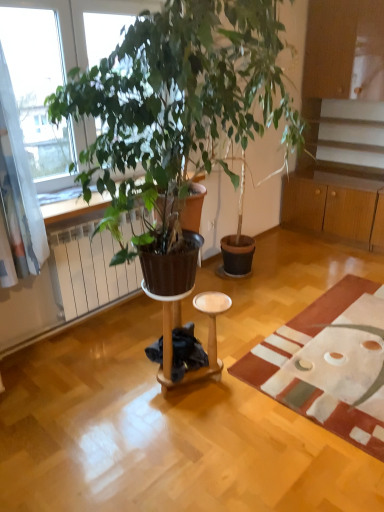
Measure the distance between wooden cabinet at right and camera.

The distance of wooden cabinet at right from camera is 3.32 meters.

The height and width of the screenshot is (512, 384). I want to click on brown matte radiator at left, so click(x=88, y=270).

The image size is (384, 512). Describe the element at coordinates (329, 362) in the screenshot. I see `textured beige rug at lower right` at that location.

What are the coordinates of `textured beige rug at lower right` in the screenshot? It's located at (329, 362).

The image size is (384, 512). In order to click on wooden cabinet at right in this screenshot , I will do [345, 85].

From a real-world perspective, between textured beige rug at lower right and wooden cabinet at right, who is vertically lower?

textured beige rug at lower right, from a real-world perspective.

Does textured beige rug at lower right turn towards wooden cabinet at right?

No, textured beige rug at lower right is not oriented towards wooden cabinet at right.

Is textured beige rug at lower right not near wooden cabinet at right?

Yes.

Which object is thinner, textured beige rug at lower right or wooden cabinet at right?

wooden cabinet at right.

Is textured beige rug at lower right turned away from wooden side table at center?

No, textured beige rug at lower right's orientation is not away from wooden side table at center.

Would you say textured beige rug at lower right is a long distance from wooden side table at center?

No, textured beige rug at lower right is in close proximity to wooden side table at center.

Considering the relative sizes of textured beige rug at lower right and wooden side table at center in the image provided, is textured beige rug at lower right smaller than wooden side table at center?

No, textured beige rug at lower right is not smaller than wooden side table at center.

Which is correct: textured beige rug at lower right is inside wooden side table at center, or outside of it?

The correct answer is: outside.

Is wooden side table at center oriented towards textured beige rug at lower right?

No, wooden side table at center does not turn towards textured beige rug at lower right.

Based on the photo, which of these two, wooden side table at center or textured beige rug at lower right, is smaller?

Smaller between the two is wooden side table at center.

From a real-world perspective, between wooden side table at center and textured beige rug at lower right, who is vertically lower?

In real-world perspective, textured beige rug at lower right is lower.

Is wooden side table at center shorter than textured beige rug at lower right?

Incorrect, the height of wooden side table at center does not fall short of that of textured beige rug at lower right.

Is wooden cabinet at right next to wooden side table at center and touching it?

wooden cabinet at right is not next to wooden side table at center, and they're not touching.

In the scene shown: What's the angular difference between wooden cabinet at right and wooden side table at center's facing directions?

89.7 degrees.

Which object is closer to the camera, wooden cabinet at right or wooden side table at center?

wooden side table at center.

Between wooden cabinet at right and textured beige rug at lower right, which one has more height?

Standing taller between the two is wooden cabinet at right.

Does wooden cabinet at right turn towards textured beige rug at lower right?

No, wooden cabinet at right is not facing towards textured beige rug at lower right.

Locate an element on the screen. This screenshot has height=512, width=384. mat in front of the wooden cabinet at right is located at coordinates (329, 362).

Consider the image. Does wooden cabinet at right have a smaller size compared to textured beige rug at lower right?

Incorrect, wooden cabinet at right is not smaller in size than textured beige rug at lower right.

Where is `radiator below the wooden cabinet at right (from the image's perspective)`? radiator below the wooden cabinet at right (from the image's perspective) is located at coordinates (88, 270).

Considering the relative positions of wooden cabinet at right and brown matte radiator at left in the image provided, is wooden cabinet at right to the left of brown matte radiator at left from the viewer's perspective?

In fact, wooden cabinet at right is to the right of brown matte radiator at left.

Is wooden cabinet at right smaller than brown matte radiator at left?

Incorrect, wooden cabinet at right is not smaller in size than brown matte radiator at left.

Based on their sizes in the image, would you say wooden side table at center is bigger or smaller than brown matte radiator at left?

Considering their sizes, wooden side table at center takes up less space than brown matte radiator at left.

Is wooden side table at center taller than brown matte radiator at left?

In fact, wooden side table at center may be shorter than brown matte radiator at left.

Is wooden side table at center located outside brown matte radiator at left?

Yes, wooden side table at center is outside of brown matte radiator at left.

From a real-world perspective, is wooden side table at center under brown matte radiator at left?

Correct, in the physical world, wooden side table at center is lower than brown matte radiator at left.

I want to click on mat that appears on the left of wooden cabinet at right, so click(329, 362).

Locate an element on the screen. mat that appears below the wooden side table at center (from a real-world perspective) is located at coordinates (329, 362).

Which object lies nearer to the anchor point textured beige rug at lower right, wooden cabinet at right or wooden side table at center?

Based on the image, wooden side table at center appears to be nearer to textured beige rug at lower right.

Based on the photo, from the image, which object appears to be nearer to wooden cabinet at right, textured beige rug at lower right or wooden side table at center?

Based on the image, textured beige rug at lower right appears to be nearer to wooden cabinet at right.

In the scene shown: Based on their spatial positions, is wooden side table at center or brown matte radiator at left further from textured beige rug at lower right?

brown matte radiator at left lies further to textured beige rug at lower right than the other object.

When comparing their distances from brown matte radiator at left, does wooden cabinet at right or textured beige rug at lower right seem closer?

textured beige rug at lower right.

From the image, which object appears to be nearer to brown matte radiator at left, textured beige rug at lower right or wooden side table at center?

wooden side table at center is closer to brown matte radiator at left.

Considering their positions, is textured beige rug at lower right positioned further to brown matte radiator at left than wooden cabinet at right?

Based on the image, wooden cabinet at right appears to be further to brown matte radiator at left.

In the scene shown: Looking at the image, which one is located closer to wooden side table at center, wooden cabinet at right or textured beige rug at lower right?

textured beige rug at lower right.

Considering their positions, is brown matte radiator at left positioned closer to wooden cabinet at right than wooden side table at center?

The object closer to wooden cabinet at right is brown matte radiator at left.

At what (x,y) coordinates should I click in order to perform the action: click on side table that lies between wooden cabinet at right and textured beige rug at lower right from top to bottom. Please return your answer as a coordinate pair (x, y). Looking at the image, I should click on (208, 335).

In order to click on mat between brown matte radiator at left and wooden cabinet at right from left to right in this screenshot , I will do `click(329, 362)`.

At what (x,y) coordinates should I click in order to perform the action: click on side table between brown matte radiator at left and textured beige rug at lower right in the horizontal direction. Please return your answer as a coordinate pair (x, y). This screenshot has width=384, height=512. Looking at the image, I should click on (208, 335).

I want to click on side table between brown matte radiator at left and wooden cabinet at right, so click(x=208, y=335).